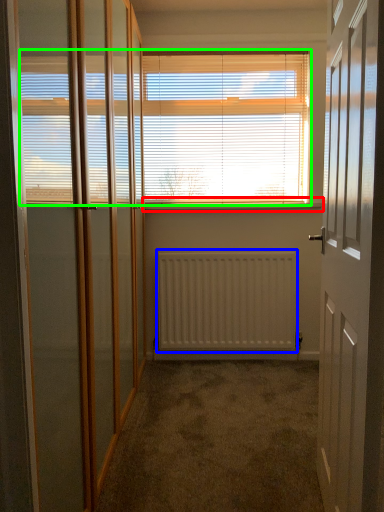
Question: Based on their relative distances, which object is farther from window sill (highlighted by a red box)? Choose from radiator (highlighted by a blue box) and window blind (highlighted by a green box).

Choices:
 (A) radiator
 (B) window blind

Answer: (A)